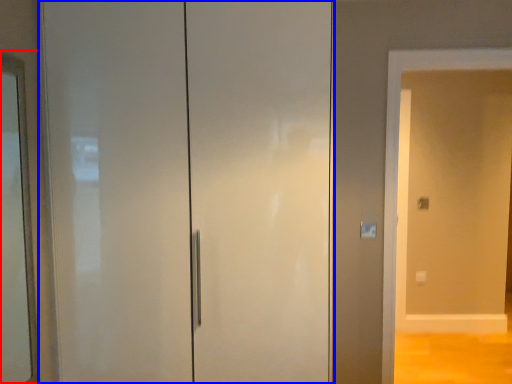
Question: Among these objects, which one is farthest to the camera, mirror (highlighted by a red box) or door (highlighted by a blue box)?

Choices:
 (A) mirror
 (B) door

Answer: (B)